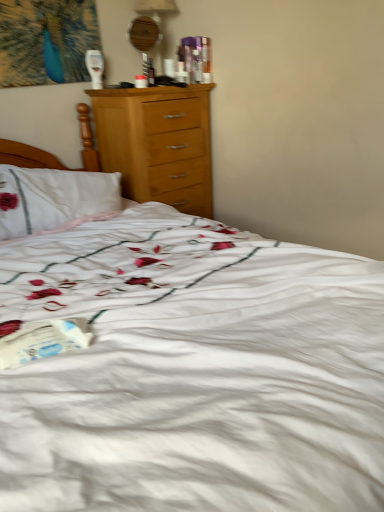
Question: From a real-world perspective, is wooden table lamp at upper center positioned under white paper at lower left based on gravity?

Choices:
 (A) no
 (B) yes

Answer: (A)

Question: Can white paper at lower left be found inside wooden table lamp at upper center?

Choices:
 (A) no
 (B) yes

Answer: (A)

Question: From the image's perspective, is wooden table lamp at upper center located above white paper at lower left?

Choices:
 (A) yes
 (B) no

Answer: (A)

Question: Does wooden table lamp at upper center have a greater height compared to white paper at lower left?

Choices:
 (A) no
 (B) yes

Answer: (B)

Question: Considering the relative sizes of wooden table lamp at upper center and white paper at lower left in the image provided, is wooden table lamp at upper center wider than white paper at lower left?

Choices:
 (A) no
 (B) yes

Answer: (A)

Question: Is white paper at lower left at the back of wooden table lamp at upper center?

Choices:
 (A) no
 (B) yes

Answer: (A)

Question: Is white paper at lower left not near wooden table lamp at upper center?

Choices:
 (A) no
 (B) yes

Answer: (B)

Question: Is white paper at lower left facing away from wooden table lamp at upper center?

Choices:
 (A) no
 (B) yes

Answer: (A)

Question: Considering the relative sizes of white paper at lower left and wooden table lamp at upper center in the image provided, is white paper at lower left bigger than wooden table lamp at upper center?

Choices:
 (A) yes
 (B) no

Answer: (B)

Question: From a real-world perspective, is white paper at lower left located beneath wooden table lamp at upper center?

Choices:
 (A) no
 (B) yes

Answer: (B)

Question: Can you confirm if white paper at lower left is wider than wooden table lamp at upper center?

Choices:
 (A) yes
 (B) no

Answer: (A)

Question: Does white paper at lower left have a lesser width compared to wooden table lamp at upper center?

Choices:
 (A) yes
 (B) no

Answer: (B)

Question: From the image's perspective, is white paper at lower left located above or below wooden table lamp at upper center?

Choices:
 (A) below
 (B) above

Answer: (A)